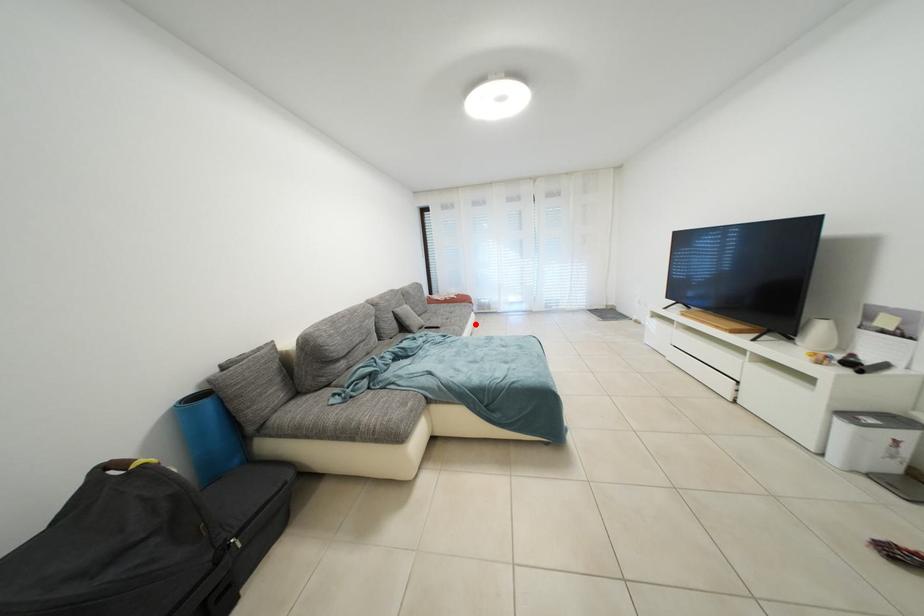
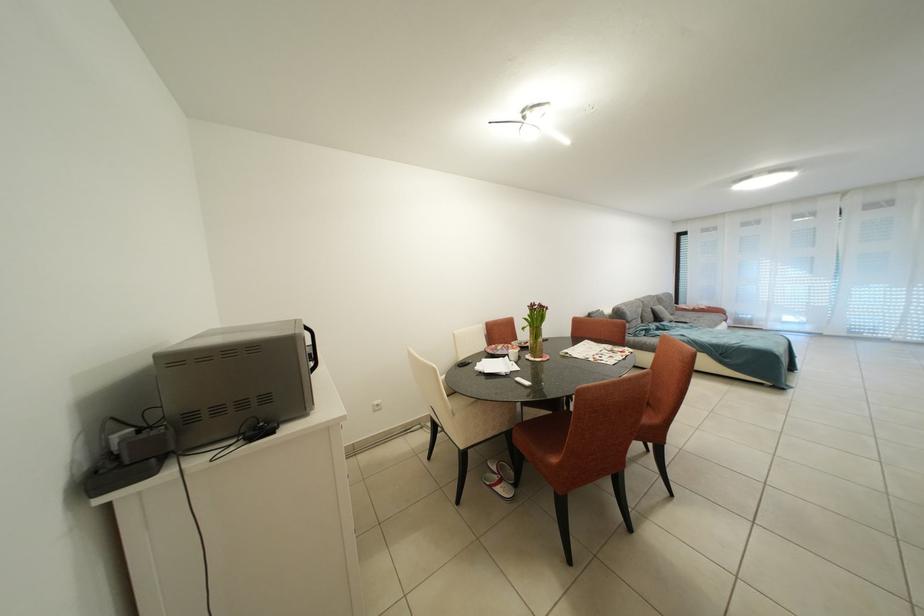
Question: I am providing you with two images of the same scene from different viewpoints. Image1 has a red point marked. In image2, the corresponding 3D location appears at what relative position? Reply with the corresponding letter.

Choices:
 (A) Closer
 (B) Farther

Answer: (B)